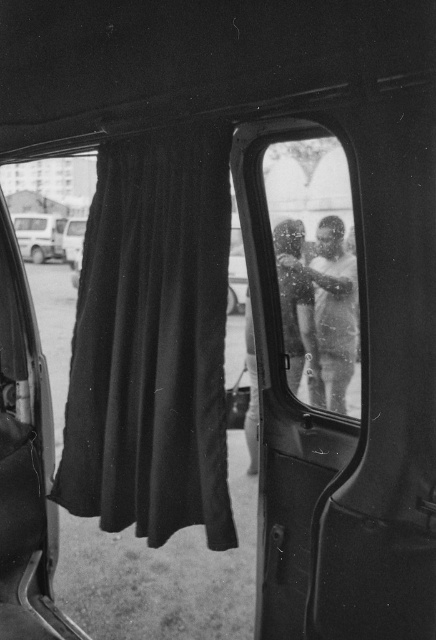
Question: Does black velvet curtain at left have a lesser width compared to metallic silver van at center?

Choices:
 (A) yes
 (B) no

Answer: (B)

Question: Which object is closer to the camera taking this photo?

Choices:
 (A) metallic silver van at center
 (B) black velvet curtain at left

Answer: (B)

Question: Does black velvet curtain at left come behind metallic silver van at left?

Choices:
 (A) no
 (B) yes

Answer: (A)

Question: Which object is farther from the camera taking this photo?

Choices:
 (A) black velvet curtain at left
 (B) metallic silver van at center

Answer: (B)

Question: Based on their relative distances, which object is farther from the metallic silver van at center?

Choices:
 (A) black velvet curtain at left
 (B) metallic silver van at left

Answer: (A)

Question: Does black velvet curtain at left come in front of metallic silver van at center?

Choices:
 (A) no
 (B) yes

Answer: (B)